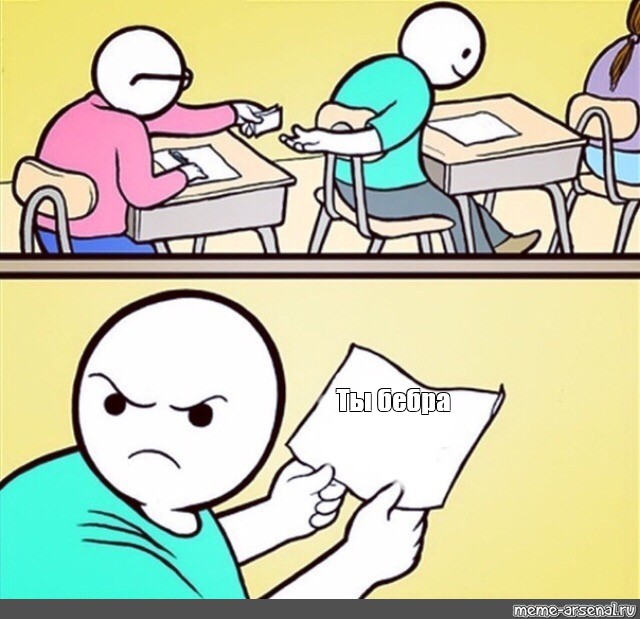
Find the location of a particular element. The width and height of the screenshot is (640, 619). back chair legs on the right side of the top image is located at coordinates (626, 231), (573, 201).